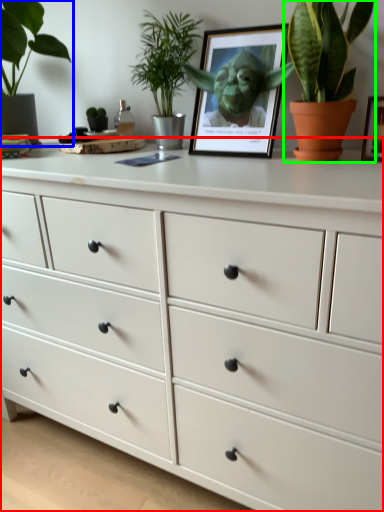
Question: Based on their relative distances, which object is nearer to chest of drawers (highlighted by a red box)? Choose from houseplant (highlighted by a blue box) and houseplant (highlighted by a green box).

Choices:
 (A) houseplant
 (B) houseplant

Answer: (B)